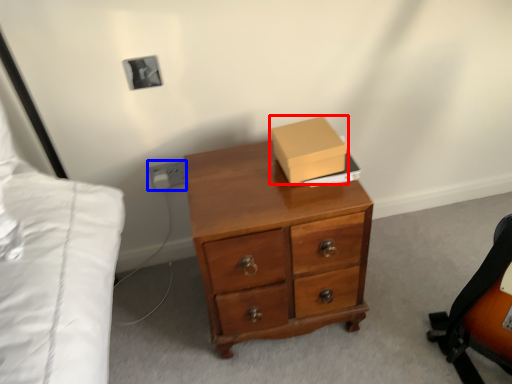
Question: Which object is further to the camera taking this photo, box (highlighted by a red box) or electric outlet (highlighted by a blue box)?

Choices:
 (A) box
 (B) electric outlet

Answer: (B)